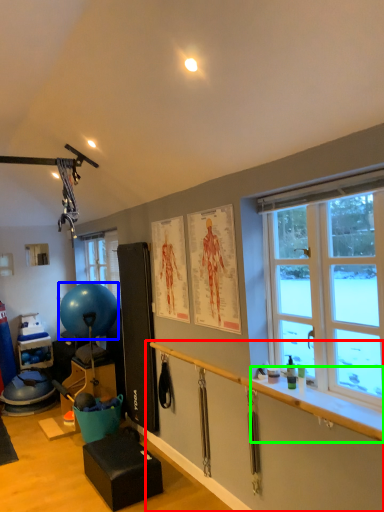
Question: Which object is positioned closest to garage door (highlighted by a red box)? Select from ball (highlighted by a blue box) and window sill (highlighted by a green box).

Choices:
 (A) ball
 (B) window sill

Answer: (B)